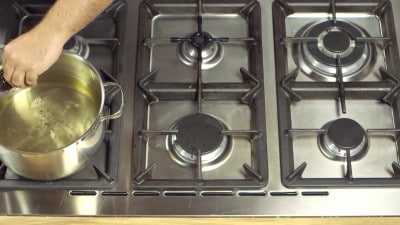
Where is `pot`? pot is located at coordinates (54, 122).